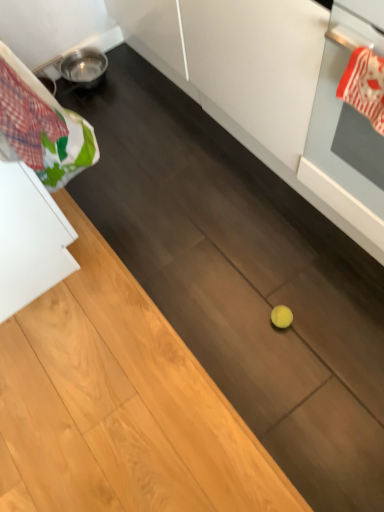
Question: Is white glossy oven at right oriented towards plaid fabric laundry at upper left?

Choices:
 (A) yes
 (B) no

Answer: (B)

Question: From the image's perspective, is white glossy oven at right located beneath plaid fabric laundry at upper left?

Choices:
 (A) yes
 (B) no

Answer: (A)

Question: Considering the relative sizes of white glossy oven at right and plaid fabric laundry at upper left in the image provided, is white glossy oven at right wider than plaid fabric laundry at upper left?

Choices:
 (A) yes
 (B) no

Answer: (A)

Question: Is white glossy oven at right positioned with its back to plaid fabric laundry at upper left?

Choices:
 (A) no
 (B) yes

Answer: (A)

Question: Could plaid fabric laundry at upper left be considered to be inside white glossy oven at right?

Choices:
 (A) yes
 (B) no

Answer: (B)

Question: In terms of size, does white glossy oven at right appear bigger or smaller than red and white striped oven mitt at upper right?

Choices:
 (A) big
 (B) small

Answer: (A)

Question: Would you say white glossy oven at right is to the left or to the right of red and white striped oven mitt at upper right in the picture?

Choices:
 (A) left
 (B) right

Answer: (B)

Question: From a real-world perspective, is white glossy oven at right positioned above or below red and white striped oven mitt at upper right?

Choices:
 (A) below
 (B) above

Answer: (A)

Question: Relative to red and white striped oven mitt at upper right, is white glossy oven at right in front or behind?

Choices:
 (A) behind
 (B) front

Answer: (B)

Question: Considering their positions, is plaid fabric laundry at upper left located in front of or behind red and white striped oven mitt at upper right?

Choices:
 (A) front
 (B) behind

Answer: (A)

Question: From their relative heights in the image, would you say plaid fabric laundry at upper left is taller or shorter than red and white striped oven mitt at upper right?

Choices:
 (A) tall
 (B) short

Answer: (A)

Question: Which is correct: plaid fabric laundry at upper left is inside red and white striped oven mitt at upper right, or outside of it?

Choices:
 (A) inside
 (B) outside

Answer: (B)

Question: From a real-world perspective, relative to red and white striped oven mitt at upper right, is plaid fabric laundry at upper left vertically above or below?

Choices:
 (A) above
 (B) below

Answer: (A)

Question: From the image's perspective, is red and white striped oven mitt at upper right positioned above or below plaid fabric laundry at upper left?

Choices:
 (A) above
 (B) below

Answer: (B)

Question: Is red and white striped oven mitt at upper right situated inside plaid fabric laundry at upper left or outside?

Choices:
 (A) outside
 (B) inside

Answer: (A)